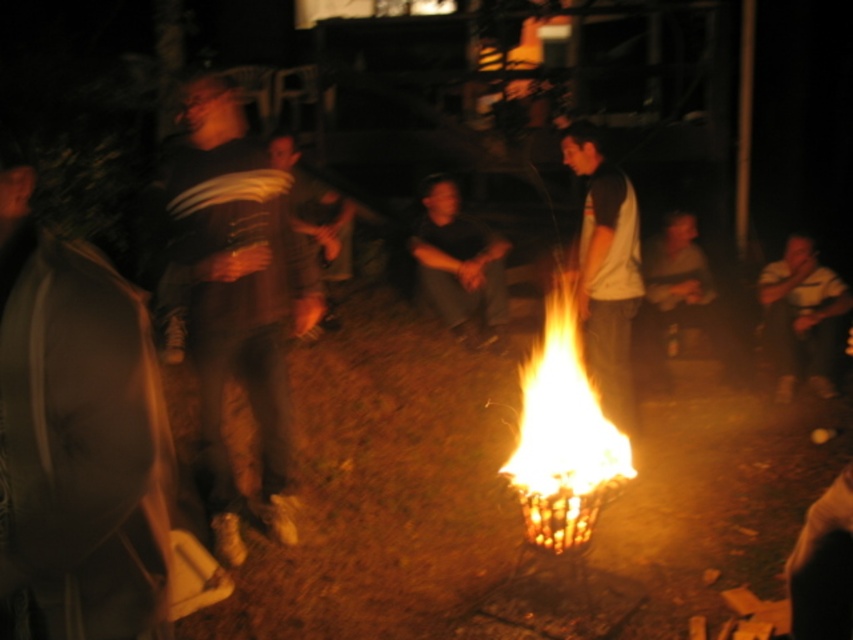
You are standing at the campfire and want to find the point at coordinates point (74, 432). According to the scene, where is this point located?

The point (74, 432) is on matte gray jacket at left.

You are at a campfire and want to hand a marshmallow stick to the person wearing the white cotton shirt at center and the person wearing the yellow striped shirt at right. If you start at the left side of the campfire, which shirt should you approach first?

The white cotton shirt at center is to the left of the yellow striped shirt at right, so you should approach the white cotton shirt at center first when starting from the left side of the campfire.

You are a photographer trying to capture a group photo of the people around the campfire. You want to ensure both the white cotton shirt at center and the yellow striped shirt at right are clearly visible. Which shirt should you focus on to ensure both are in focus?

The white cotton shirt at center is smaller than the yellow striped shirt at right. To ensure both are in focus, focus on the yellow striped shirt at right since it is larger and easier to capture clearly.